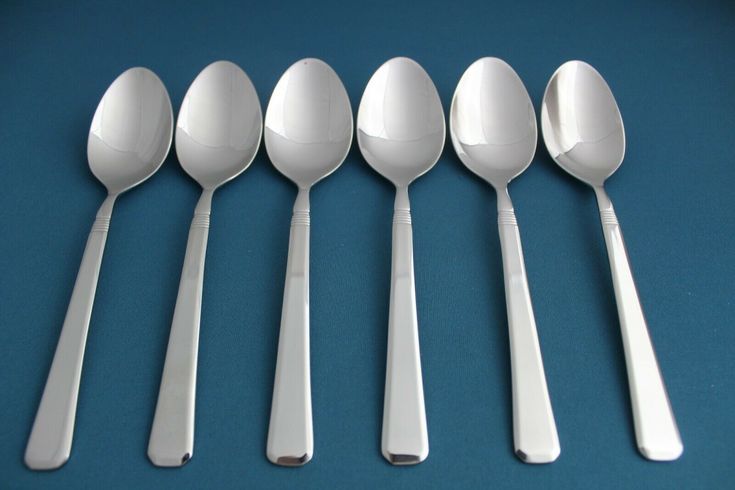
The height and width of the screenshot is (490, 735). I want to click on spoons, so click(136, 148), click(212, 145), click(300, 142), click(380, 148), click(491, 145), click(576, 141).